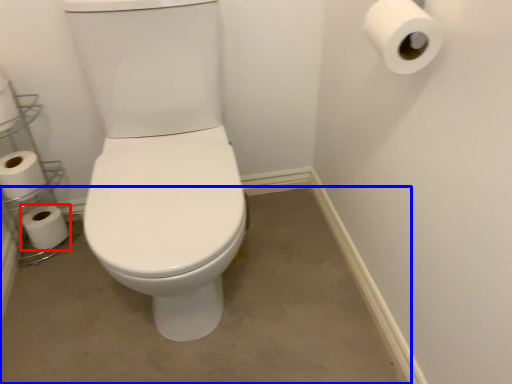
Question: Among these objects, which one is farthest to the camera, toilet paper (highlighted by a red box) or concrete (highlighted by a blue box)?

Choices:
 (A) toilet paper
 (B) concrete

Answer: (A)